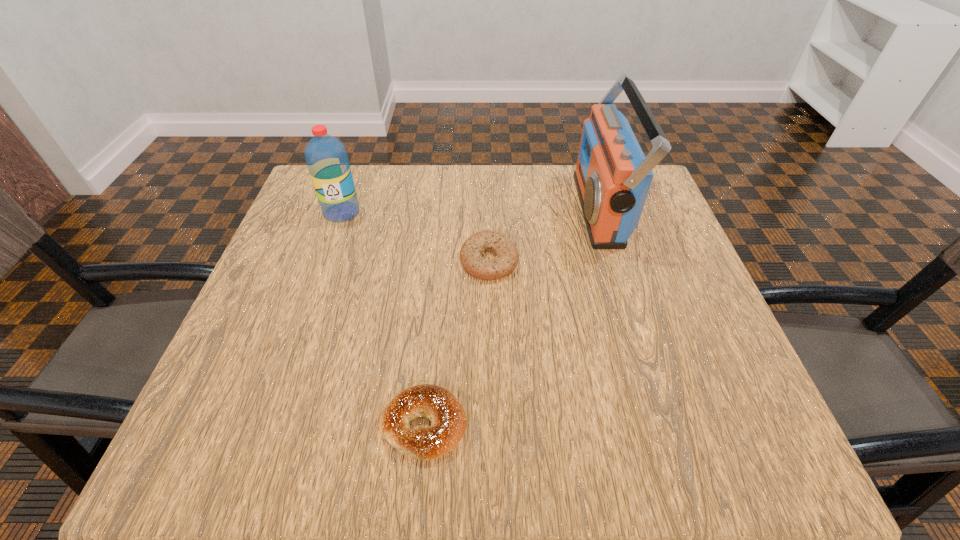
Identify the location of blank area in the image that satisfies the following two spatial constraints: 1. on the front label of the nearer bagel; 2. on the left side of the leftmost object. The image size is (960, 540). (267, 424).

Identify the location of free location that satisfies the following two spatial constraints: 1. on the front label of the water bottle; 2. on the left side of the nearest object. (267, 424).